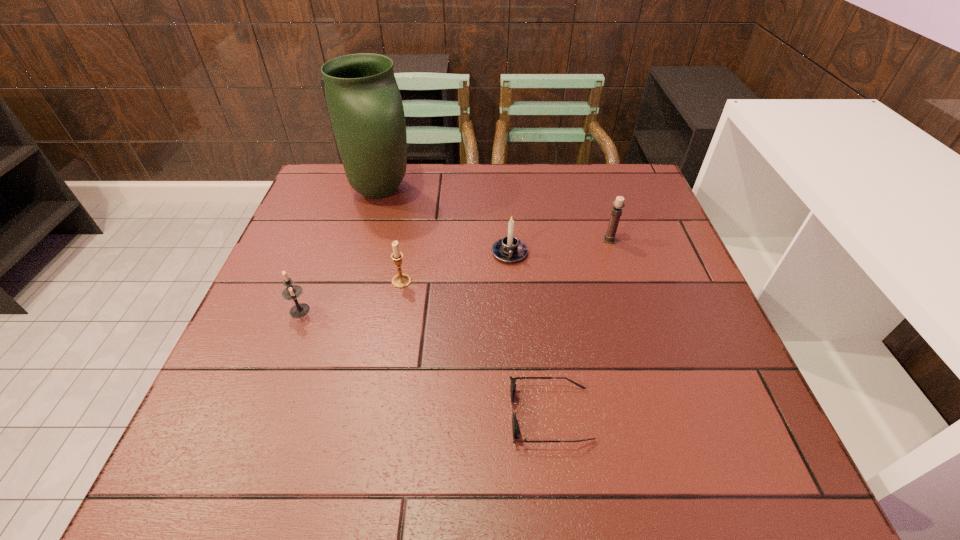
At what (x,y) coordinates should I click in order to perform the action: click on vacant space located on the right of the farthest object. Please return your answer as a coordinate pair (x, y). The width and height of the screenshot is (960, 540). Looking at the image, I should click on (549, 191).

At what (x,y) coordinates should I click in order to perform the action: click on vacant region located on the left of the rightmost candle holder. Please return your answer as a coordinate pair (x, y). Looking at the image, I should click on (510, 240).

The width and height of the screenshot is (960, 540). What are the coordinates of `vacant area situated on the front of the third candle holder from right to left` in the screenshot? It's located at (372, 445).

Where is `vacant space located 0.330m with a handle on the side of the third candle holder from left to right`? This screenshot has height=540, width=960. vacant space located 0.330m with a handle on the side of the third candle holder from left to right is located at coordinates (518, 384).

Locate an element on the screen. Image resolution: width=960 pixels, height=540 pixels. blank area located 0.100m on the back of the nearest candle holder is located at coordinates (316, 269).

Locate an element on the screen. vacant space located on the front-facing side of the sunglasses is located at coordinates (361, 414).

This screenshot has height=540, width=960. Find the location of `free point located 0.370m on the front-facing side of the sunglasses`. free point located 0.370m on the front-facing side of the sunglasses is located at coordinates (305, 414).

Identify the location of vacant space located on the front-facing side of the sunglasses. The image size is (960, 540). (344, 414).

Locate an element on the screen. The height and width of the screenshot is (540, 960). object positioned at the far edge is located at coordinates (365, 107).

At what (x,y) coordinates should I click in order to perform the action: click on object at the near edge. Please return your answer as a coordinate pair (x, y). Looking at the image, I should click on (515, 425).